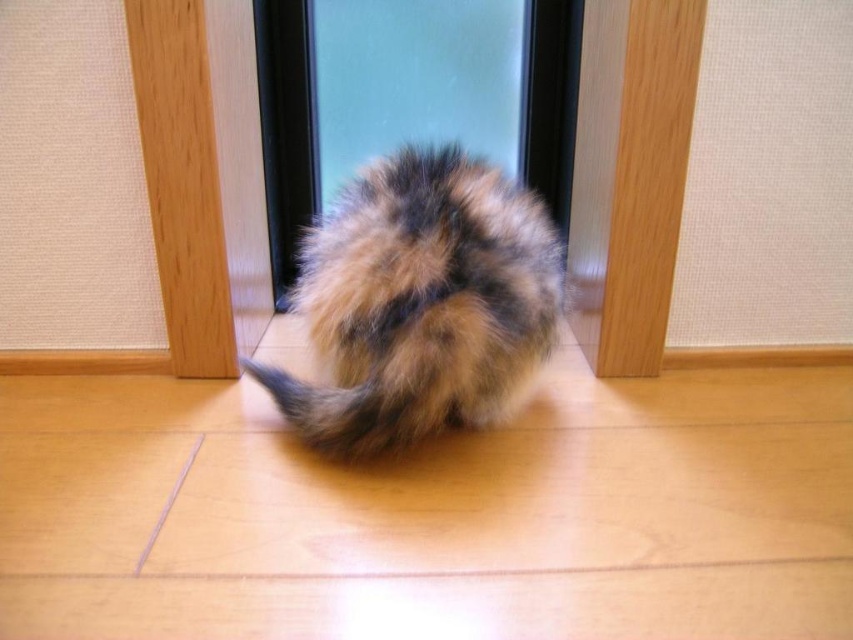
Can you confirm if transparent glass door at center is smaller than fuzzy fur tail at center?

Incorrect, transparent glass door at center is not smaller in size than fuzzy fur tail at center.

What do you see at coordinates (405, 96) in the screenshot?
I see `transparent glass door at center` at bounding box center [405, 96].

The height and width of the screenshot is (640, 853). Find the location of `transparent glass door at center`. transparent glass door at center is located at coordinates (405, 96).

Is fluffy fur cat at center thinner than transparent glass door at center?

Yes.

Is fluffy fur cat at center below transparent glass door at center?

Yes.

At what (x,y) coordinates should I click in order to perform the action: click on fluffy fur cat at center. Please return your answer as a coordinate pair (x, y). The height and width of the screenshot is (640, 853). Looking at the image, I should click on (421, 301).

The width and height of the screenshot is (853, 640). Identify the location of fluffy fur cat at center. (421, 301).

Can you confirm if fluffy fur cat at center is shorter than fuzzy fur tail at center?

No.

Who is more distant from viewer, (322, 429) or (392, 419)?

The point (322, 429) is behind.

You are a GUI agent. You are given a task and a screenshot of the screen. Output one action in this format:
    pyautogui.click(x=<x>, y=<y>)
    Task: Click on the fluffy fur cat at center
    
    Given the screenshot: What is the action you would take?
    (421, 301)